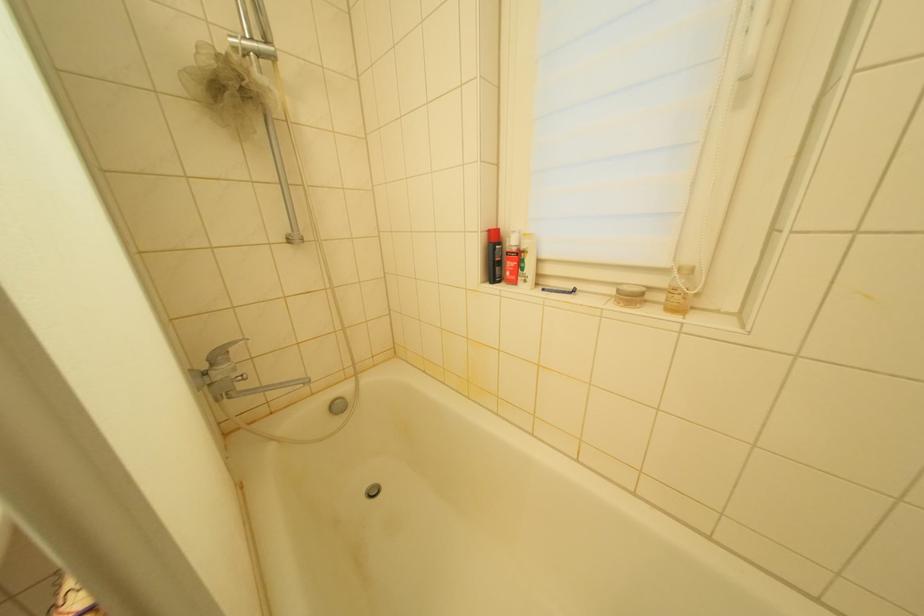
Describe the element at coordinates (494, 256) in the screenshot. The width and height of the screenshot is (924, 616). I see `the red can nozzle` at that location.